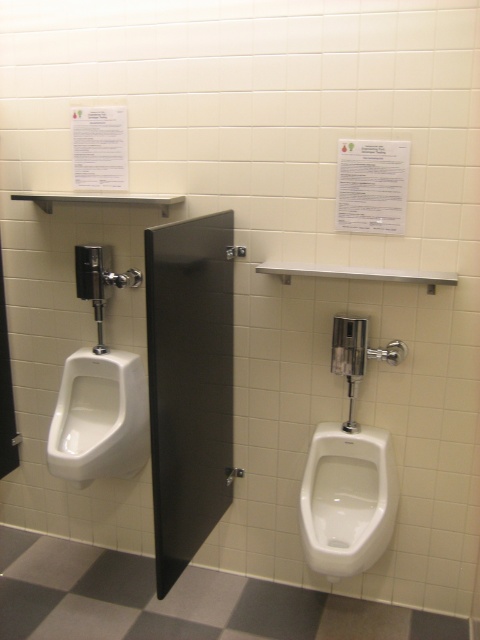
Question: Is white glossy urinal at lower right above white glossy urinal at left?

Choices:
 (A) no
 (B) yes

Answer: (A)

Question: Which of the following is the farthest from the observer?

Choices:
 (A) (57, 401)
 (B) (386, 480)

Answer: (A)

Question: Does white glossy urinal at lower right have a greater width compared to white glossy urinal at left?

Choices:
 (A) yes
 (B) no

Answer: (B)

Question: Does white glossy urinal at lower right have a lesser width compared to white glossy urinal at left?

Choices:
 (A) no
 (B) yes

Answer: (B)